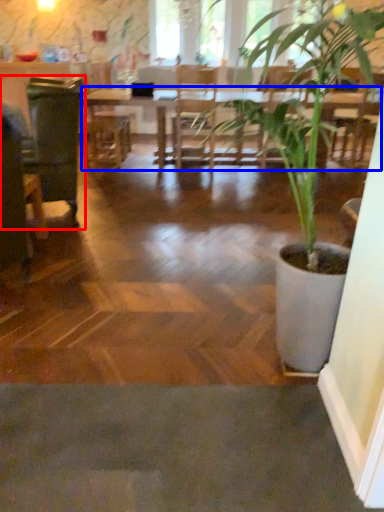
Question: Which of the following is the farthest to the observer, swivel chair (highlighted by a red box) or table (highlighted by a blue box)?

Choices:
 (A) swivel chair
 (B) table

Answer: (B)